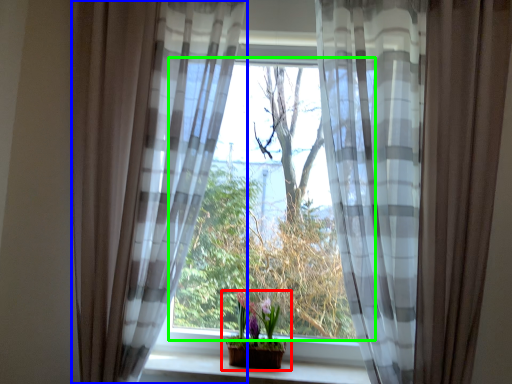
Question: Based on their relative distances, which object is farther from houseplant (highlighted by a red box)? Choose from curtain (highlighted by a blue box) and window (highlighted by a green box).

Choices:
 (A) curtain
 (B) window

Answer: (A)